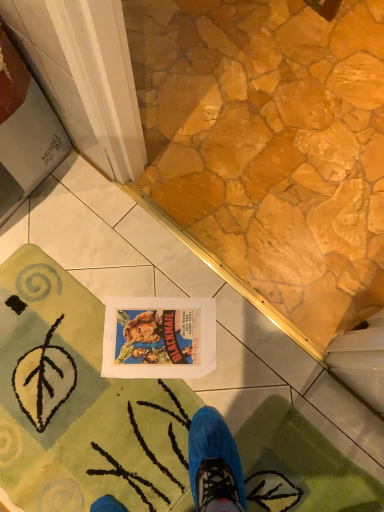
The height and width of the screenshot is (512, 384). I want to click on green plush bath mat at lower left, the 1th bath mat in the right-to-left sequence, so click(x=299, y=466).

Measure the distance between green plush bath mat at lower left, the 2th bath mat from the left, and camera.

They are 3.40 feet apart.

The height and width of the screenshot is (512, 384). Describe the element at coordinates (299, 466) in the screenshot. I see `green plush bath mat at lower left, the 2th bath mat from the left` at that location.

At what (x,y) coordinates should I click in order to perform the action: click on green plush bath mat at lower left, which is the first bath mat from left to right. Please return your answer as a coordinate pair (x, y). This screenshot has height=512, width=384. Looking at the image, I should click on (83, 405).

What do you see at coordinates (83, 405) in the screenshot? The width and height of the screenshot is (384, 512). I see `green plush bath mat at lower left, which is the first bath mat from left to right` at bounding box center [83, 405].

Where is `green plush bath mat at lower left, the 2th bath mat from the left`? Image resolution: width=384 pixels, height=512 pixels. green plush bath mat at lower left, the 2th bath mat from the left is located at coordinates (299, 466).

Is green plush bath mat at lower left, the 2th bath mat from the left, to the left or to the right of green plush bath mat at lower left, which is the first bath mat from left to right, in the image?

green plush bath mat at lower left, the 2th bath mat from the left, is positioned on green plush bath mat at lower left, which is the first bath mat from left to right,'s right side.

Is green plush bath mat at lower left, the 2th bath mat from the left, behind green plush bath mat at lower left, the 2th bath mat positioned from the right?

No, green plush bath mat at lower left, the 2th bath mat from the left, is in front of green plush bath mat at lower left, the 2th bath mat positioned from the right.

Considering the points (348, 478) and (38, 482), which point is behind, point (348, 478) or point (38, 482)?

The point (348, 478) is behind.

From the image's perspective, is green plush bath mat at lower left, the 1th bath mat in the right-to-left sequence, above or below green plush bath mat at lower left, which is the first bath mat from left to right?

green plush bath mat at lower left, the 1th bath mat in the right-to-left sequence, is below green plush bath mat at lower left, which is the first bath mat from left to right.

From a real-world perspective, is green plush bath mat at lower left, the 1th bath mat in the right-to-left sequence, physically located above or below green plush bath mat at lower left, which is the first bath mat from left to right?

In terms of real-world spatial position, green plush bath mat at lower left, the 1th bath mat in the right-to-left sequence, is above green plush bath mat at lower left, which is the first bath mat from left to right.

Considering the relative sizes of green plush bath mat at lower left, the 2th bath mat from the left, and green plush bath mat at lower left, the 2th bath mat positioned from the right, in the image provided, is green plush bath mat at lower left, the 2th bath mat from the left, thinner than green plush bath mat at lower left, the 2th bath mat positioned from the right,?

Yes.

Based on the photo, can you confirm if green plush bath mat at lower left, the 2th bath mat from the left, is taller than green plush bath mat at lower left, the 2th bath mat positioned from the right?

Yes.

Who is bigger, green plush bath mat at lower left, the 2th bath mat from the left, or green plush bath mat at lower left, the 2th bath mat positioned from the right?

green plush bath mat at lower left, the 2th bath mat positioned from the right, is bigger.

Is green plush bath mat at lower left, the 2th bath mat positioned from the right, located within green plush bath mat at lower left, the 2th bath mat from the left?

No, green plush bath mat at lower left, the 2th bath mat positioned from the right, is not surrounded by green plush bath mat at lower left, the 2th bath mat from the left.

Are green plush bath mat at lower left, the 2th bath mat from the left, and green plush bath mat at lower left, which is the first bath mat from left to right, far apart?

No, green plush bath mat at lower left, the 2th bath mat from the left, is in close proximity to green plush bath mat at lower left, which is the first bath mat from left to right.

Could you tell me if green plush bath mat at lower left, the 2th bath mat from the left, is turned towards green plush bath mat at lower left, which is the first bath mat from left to right?

Yes.

Can you tell me how much green plush bath mat at lower left, the 1th bath mat in the right-to-left sequence, and green plush bath mat at lower left, the 2th bath mat positioned from the right, differ in facing direction?

green plush bath mat at lower left, the 1th bath mat in the right-to-left sequence, and green plush bath mat at lower left, the 2th bath mat positioned from the right, are facing 87.2 degrees away from each other.

How much distance is there between green plush bath mat at lower left, the 2th bath mat from the left, and green plush bath mat at lower left, which is the first bath mat from left to right?

They are 6.45 inches apart.

Locate an element on the screen. This screenshot has width=384, height=512. bath mat lying on the right of green plush bath mat at lower left, which is the first bath mat from left to right is located at coordinates (299, 466).

Considering the relative positions of green plush bath mat at lower left, which is the first bath mat from left to right, and green plush bath mat at lower left, the 2th bath mat from the left, in the image provided, is green plush bath mat at lower left, which is the first bath mat from left to right, to the right of green plush bath mat at lower left, the 2th bath mat from the left, from the viewer's perspective?

No.

Which object is closer to the camera taking this photo, green plush bath mat at lower left, which is the first bath mat from left to right, or green plush bath mat at lower left, the 1th bath mat in the right-to-left sequence?

green plush bath mat at lower left, the 1th bath mat in the right-to-left sequence, is in front.

Which is behind, point (334, 471) or point (374, 498)?

The point (334, 471) is more distant.

From the image's perspective, is green plush bath mat at lower left, the 2th bath mat positioned from the right, above green plush bath mat at lower left, the 2th bath mat from the left?

Indeed, from the image's perspective, green plush bath mat at lower left, the 2th bath mat positioned from the right, is shown above green plush bath mat at lower left, the 2th bath mat from the left.

From a real-world perspective, which object rests below the other?

From a 3D spatial view, green plush bath mat at lower left, the 2th bath mat positioned from the right, is below.

Between green plush bath mat at lower left, which is the first bath mat from left to right, and green plush bath mat at lower left, the 1th bath mat in the right-to-left sequence, which one has smaller width?

Thinner between the two is green plush bath mat at lower left, the 1th bath mat in the right-to-left sequence.

Is green plush bath mat at lower left, the 2th bath mat positioned from the right, taller than green plush bath mat at lower left, the 1th bath mat in the right-to-left sequence?

In fact, green plush bath mat at lower left, the 2th bath mat positioned from the right, may be shorter than green plush bath mat at lower left, the 1th bath mat in the right-to-left sequence.

Is green plush bath mat at lower left, the 2th bath mat positioned from the right, bigger than green plush bath mat at lower left, the 1th bath mat in the right-to-left sequence?

Yes.

Is green plush bath mat at lower left, the 2th bath mat positioned from the right, not within green plush bath mat at lower left, the 2th bath mat from the left?

Indeed, green plush bath mat at lower left, the 2th bath mat positioned from the right, is completely outside green plush bath mat at lower left, the 2th bath mat from the left.

Can you see green plush bath mat at lower left, which is the first bath mat from left to right, touching green plush bath mat at lower left, the 2th bath mat from the left?

No, green plush bath mat at lower left, which is the first bath mat from left to right, is not beside green plush bath mat at lower left, the 2th bath mat from the left.

Is green plush bath mat at lower left, which is the first bath mat from left to right, looking in the opposite direction of green plush bath mat at lower left, the 1th bath mat in the right-to-left sequence?

green plush bath mat at lower left, which is the first bath mat from left to right, does not have its back to green plush bath mat at lower left, the 1th bath mat in the right-to-left sequence.

Consider the image. What's the angular difference between green plush bath mat at lower left, the 2th bath mat positioned from the right, and green plush bath mat at lower left, the 1th bath mat in the right-to-left sequence,'s facing directions?

87.2 degrees separate the facing orientations of green plush bath mat at lower left, the 2th bath mat positioned from the right, and green plush bath mat at lower left, the 1th bath mat in the right-to-left sequence.

Where is `bath mat lying below the green plush bath mat at lower left, the 2th bath mat positioned from the right (from the image's perspective)`? The width and height of the screenshot is (384, 512). bath mat lying below the green plush bath mat at lower left, the 2th bath mat positioned from the right (from the image's perspective) is located at coordinates pos(299,466).

Locate an element on the screen. The height and width of the screenshot is (512, 384). bath mat that appears on the right of green plush bath mat at lower left, which is the first bath mat from left to right is located at coordinates (299, 466).

This screenshot has height=512, width=384. In order to click on bath mat behind the green plush bath mat at lower left, the 1th bath mat in the right-to-left sequence in this screenshot , I will do `click(83, 405)`.